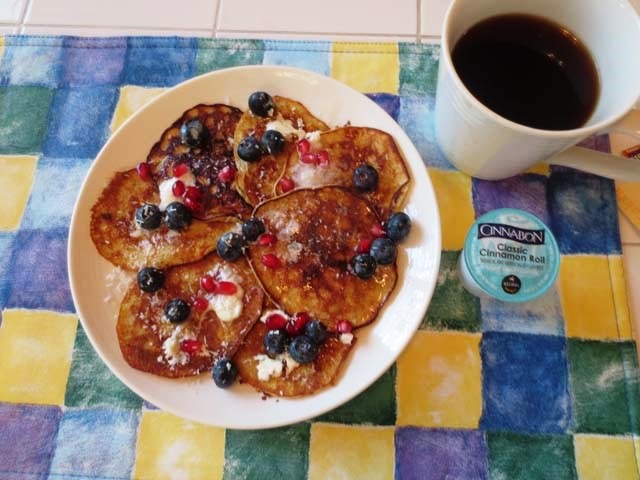
Where is `white plate`? This screenshot has width=640, height=480. white plate is located at coordinates (294, 91).